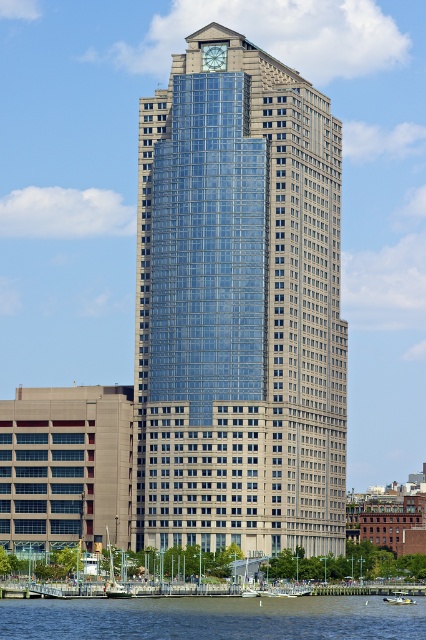
You are a photographer planning to take a photo of the waterfront scene. You want to ensure both the white wooden sailboat at lower center and the green plastic boat at lower right are clearly visible in the frame. Based on their positions, which boat should you position closer to the left edge of the photo to include both boats without cropping?

The white wooden sailboat at lower center should be positioned closer to the left edge of the photo since it is located on the left side of the green plastic boat at lower right, ensuring both boats are visible without cropping.

You are standing on the dock and looking at the glassy blue skyscraper at center and the green plastic boat at lower right. Which object is positioned higher from the ground?

The glassy blue skyscraper at center is above the green plastic boat at lower right, so it is higher from the ground.

You are standing at the base of the high rise building and looking towards the waterfront. There are two points marked in the scene, point (160, 122) and point (394, 602). Which point is closer to you?

Point (160, 122) is closer to you because it is further to the viewer than point (394, 602).